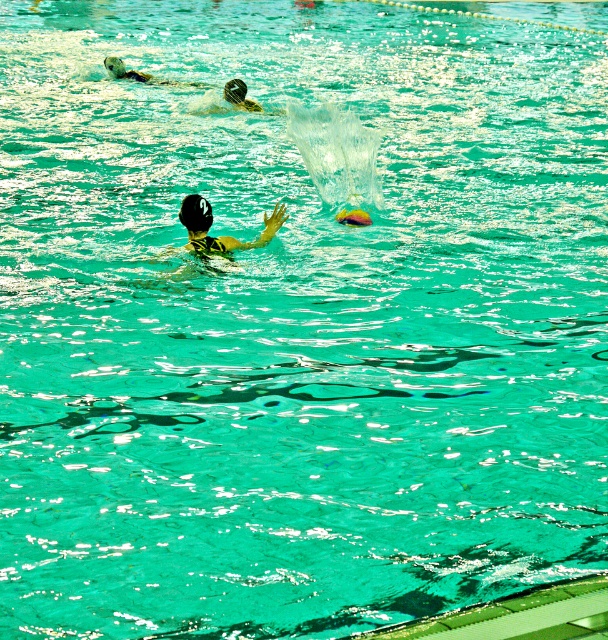
You are a water polo referee observing the game. The ball is currently out of the pool. You need to restart the game by throwing it into the pool. The rule states that players must be at least 5 meters away from the ball when you throw it. Based on the positions of the black matte swim cap at upper center and white matte swim cap at upper left, can both players be within the required distance if you throw the ball between them?

The black matte swim cap at upper center and white matte swim cap at upper left are 2.38 meters apart from each other. Since the minimum required distance is 5 meters, the players are too close to the ball if it is thrown between them. Therefore, both players are within the required distance and the throw cannot proceed as per the rules.

You are a water polo player trying to pass the ball to your teammate. The ball is currently at point [195,212]. Your teammate is wearing a black matte swim cap at center. Can you directly pass the ball to your teammate without it going through any obstacles?

Yes, the ball is at the same point as the black matte swim cap at center, meaning it is already in the teammate wearing the black matte swim cap at center location. Therefore, no need to pass it further.